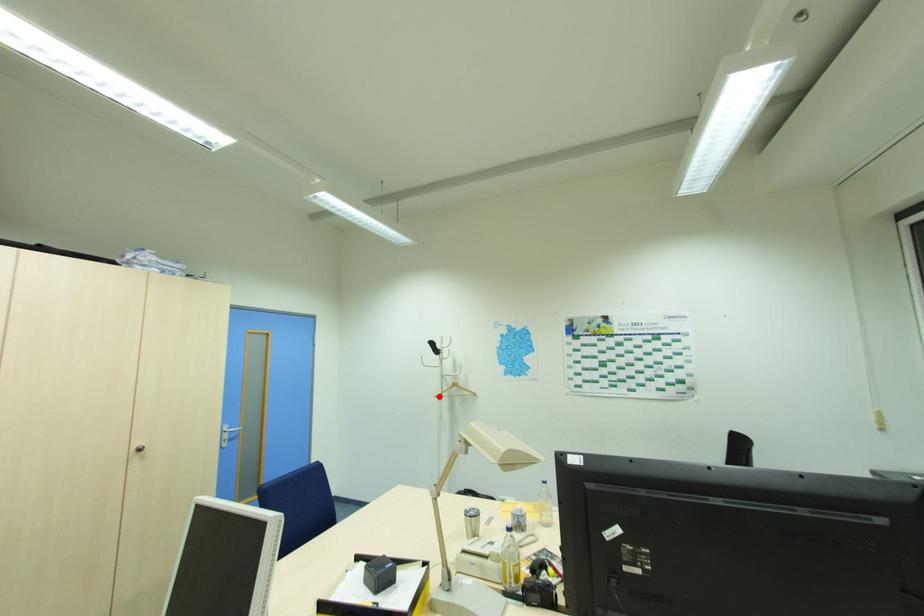
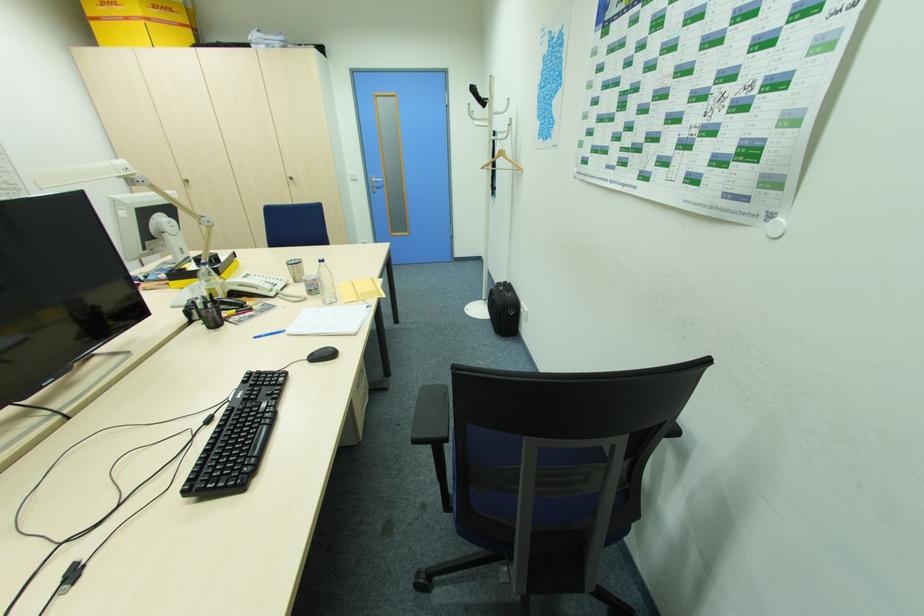
Question: I am providing you with two images of the same scene from different viewpoints. In image1, a red point is highlighted. Considering the same 3D point in image2, which of the following is correct?

Choices:
 (A) It is closer
 (B) It is farther

Answer: (A)